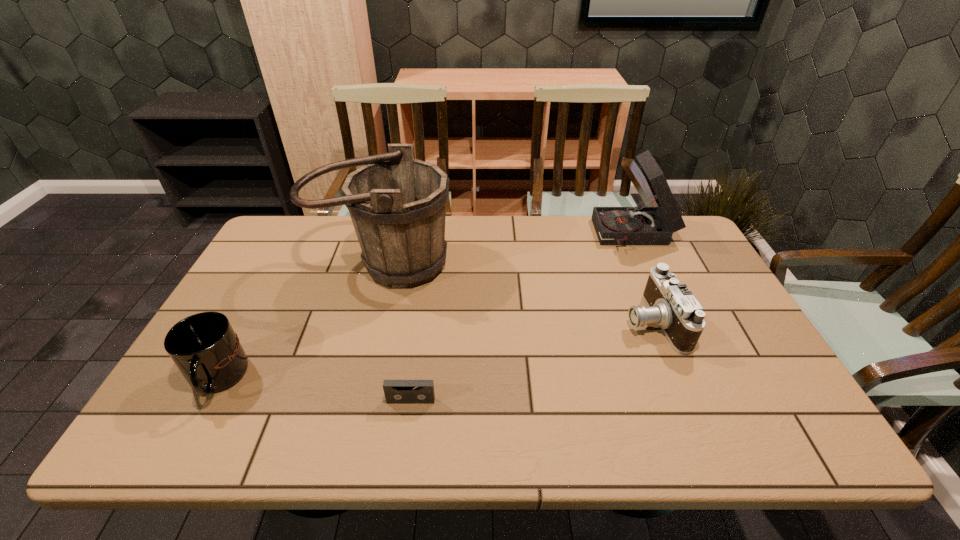
The width and height of the screenshot is (960, 540). Identify the location of bucket. [x=397, y=203].

Where is `the second tallest object`? the second tallest object is located at coordinates (636, 225).

Locate an element on the screen. This screenshot has height=540, width=960. the leftmost object is located at coordinates (204, 347).

The image size is (960, 540). Identify the location of camera. (671, 305).

Locate an element on the screen. the shortest object is located at coordinates (396, 391).

Where is `free location located on the handle side of the tallest object`? The height and width of the screenshot is (540, 960). free location located on the handle side of the tallest object is located at coordinates (361, 351).

The height and width of the screenshot is (540, 960). I want to click on vacant space located 0.340m on the front-facing side of the phonograph_record, so click(x=495, y=235).

Identify the location of vacant space situated 0.270m on the front-facing side of the phonograph_record. tap(516, 235).

Where is `vacant space situated on the front-facing side of the phonograph_record`? The height and width of the screenshot is (540, 960). vacant space situated on the front-facing side of the phonograph_record is located at coordinates (576, 235).

Where is `vacant space located with the handle on the side of the mug`? vacant space located with the handle on the side of the mug is located at coordinates coord(189,431).